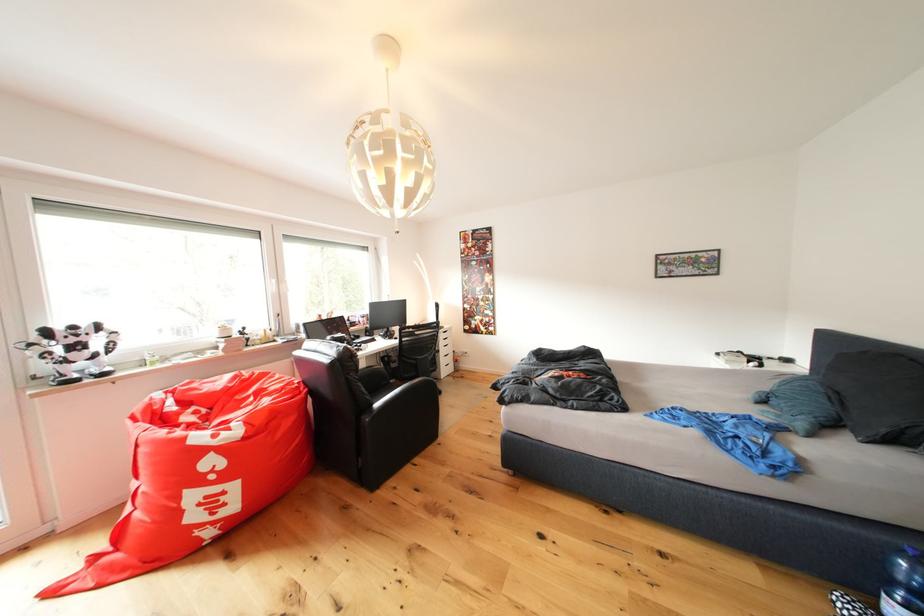
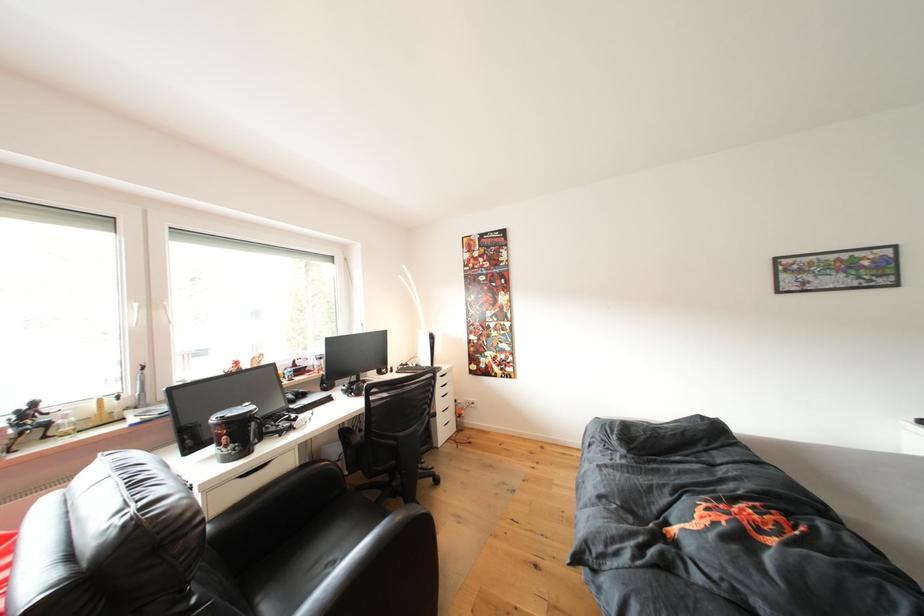
Question: I am providing you with two images of the same scene from different viewpoints. After the viewpoint changes to image2, which objects are now occluded?

Choices:
 (A) dark grey pillow
 (B) desk drawer handle
 (C) black chair sitting surface
 (D) none of these

Answer: (D)